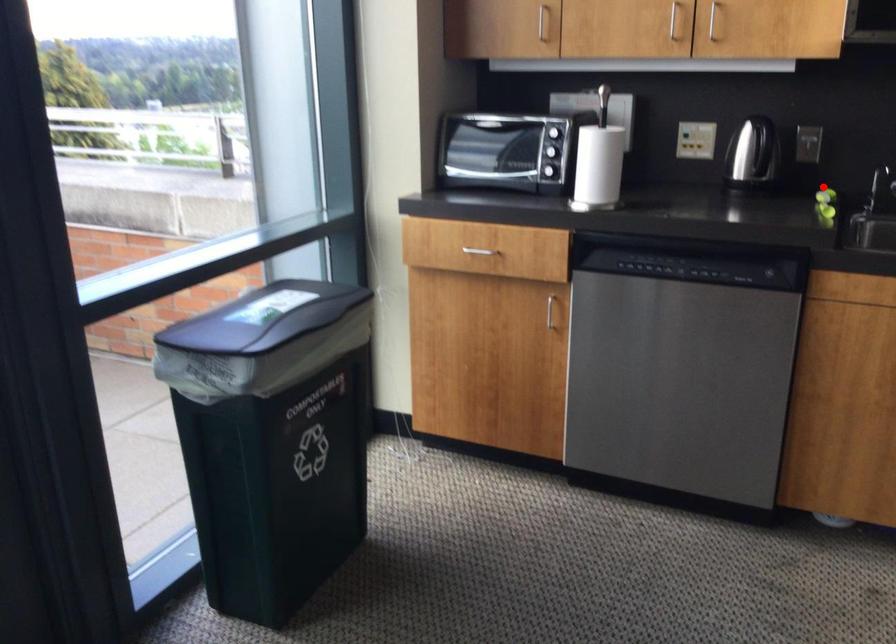
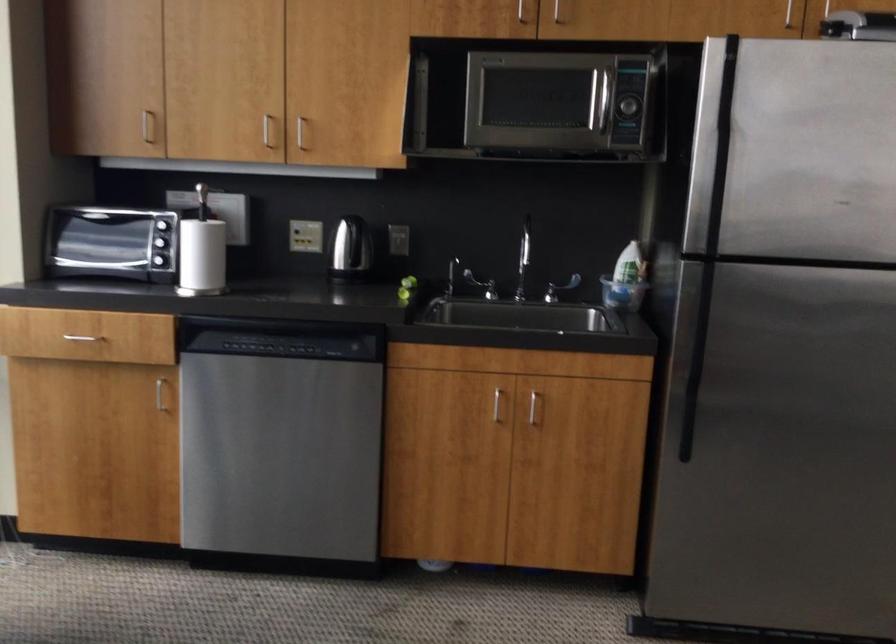
Question: A red point is marked in image1. In image2, is the corresponding 3D point closer to the camera or farther? Reply with the corresponding letter.

Choices:
 (A) The corresponding 3D point is closer.
 (B) The corresponding 3D point is farther.

Answer: (B)